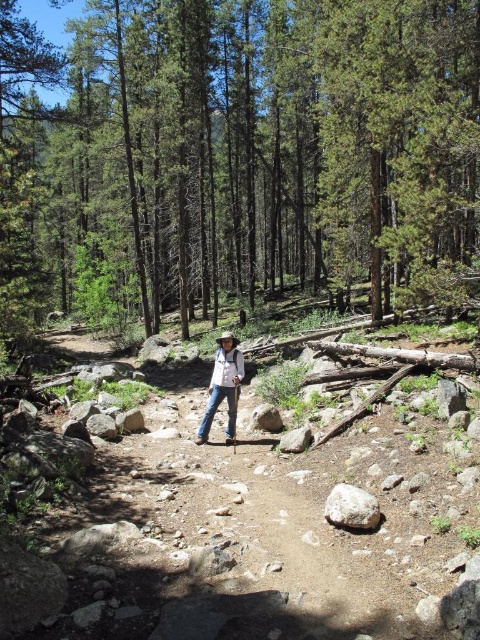
You are a drone operator trying to locate the hiker in the forest. The drone has a camera with a field of view that can only focus on objects within a 0.5x0.5 meter area. If the drone is positioned at the origin point of the coordinate system, where the hiker is at coordinates between 0 and 1, can you determine if the denim jeans at center will be within the drone camera focus area?

The denim jeans at center is located at coordinate point [224,385]. Since the drone camera can only focus on a 0.5x0.5 meter area, the denim jeans at center will be within the focus area if the coordinates fall within that range. However, without knowing the exact position of the origin or the direction the drone is facing, it is impossible to determine if the denim jeans at center will be within the focus area.